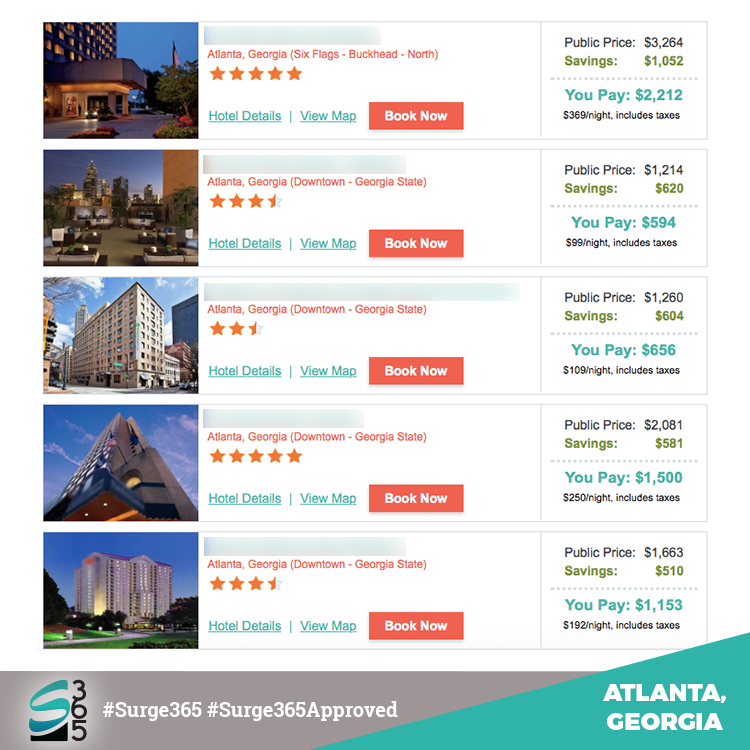
Find the location of a particular element. The width and height of the screenshot is (750, 750). photo of hotel is located at coordinates (110, 80), (112, 468), (116, 600), (129, 328), (123, 202).